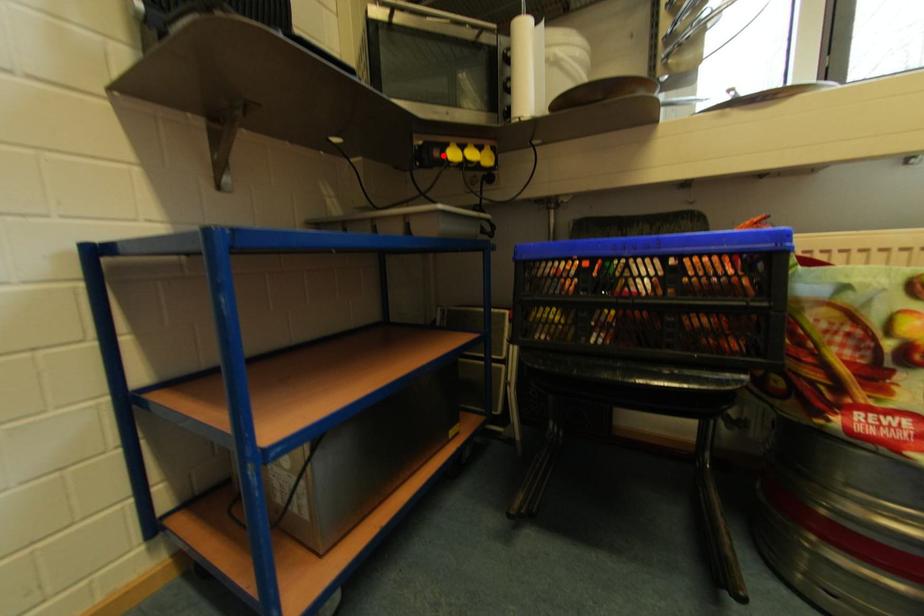
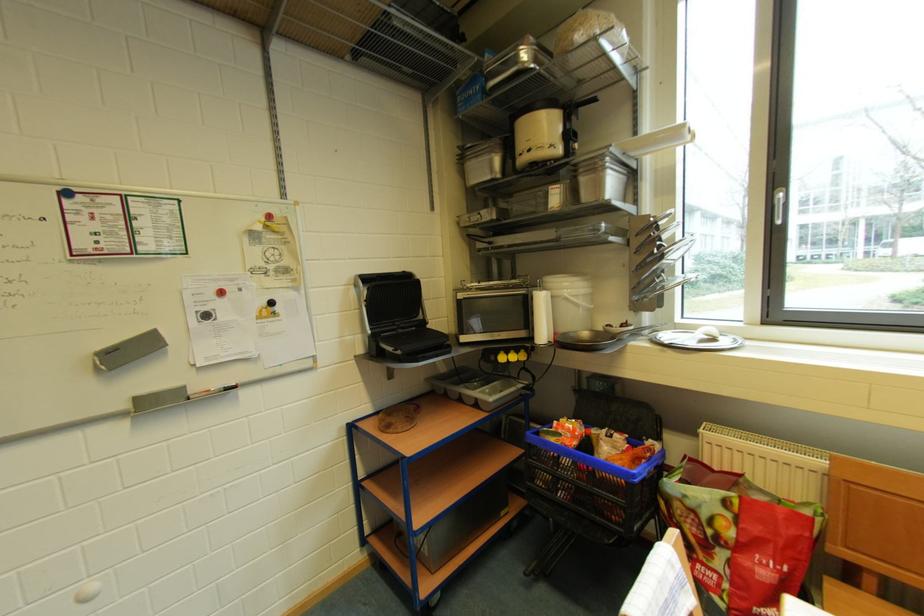
Locate, in the second image, the point that corresponds to the highlighted location in the first image.

(500, 361)